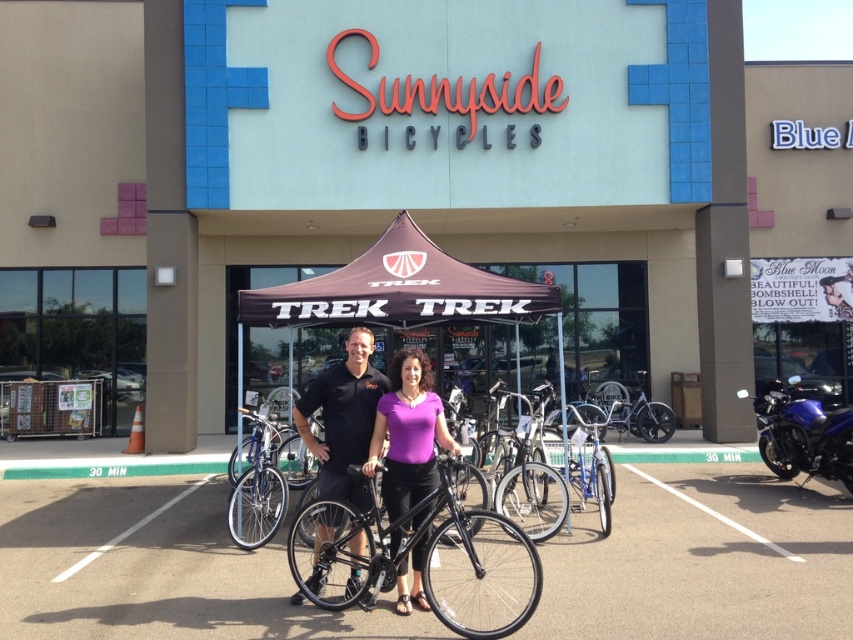
You are standing at the entrance of Sunnyside Bicycles and want to locate two specific points marked on the shop layout. The first point is at coordinates point (x=57, y=509) and the second is at point (x=376, y=515). According to the spatial arrangement, which point is closer to you when facing the shop entrance?

Point (x=376, y=515) is closer to you because it is in front of point (x=57, y=509).

You are a delivery person with a 1.2 meter wide cart. You need to park your cart in the smooth asphalt parking lot at center. There is a black matte bicycle at center in the way. Can you move the bicycle to the side so that your cart can fit into the parking spot?

The smooth asphalt parking lot at center and black matte bicycle at center are 1.06 meters apart from each other. Since your cart is 1.2 meters wide, which is wider than the distance between the parking spot and the bicycle, you will need to move the black matte bicycle at center to create enough space for your cart to fit.